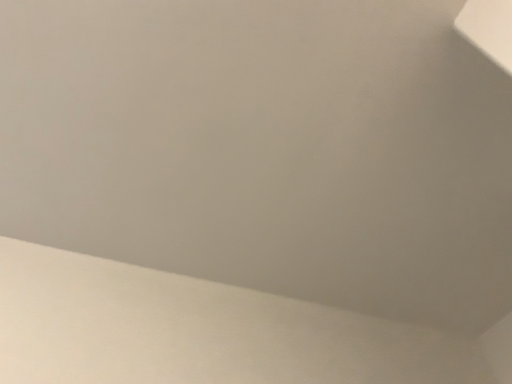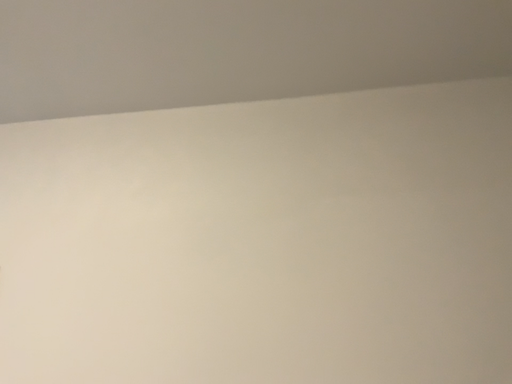
Question: Which way did the camera rotate in the video?

Choices:
 (A) rotated downward
 (B) rotated upward

Answer: (A)